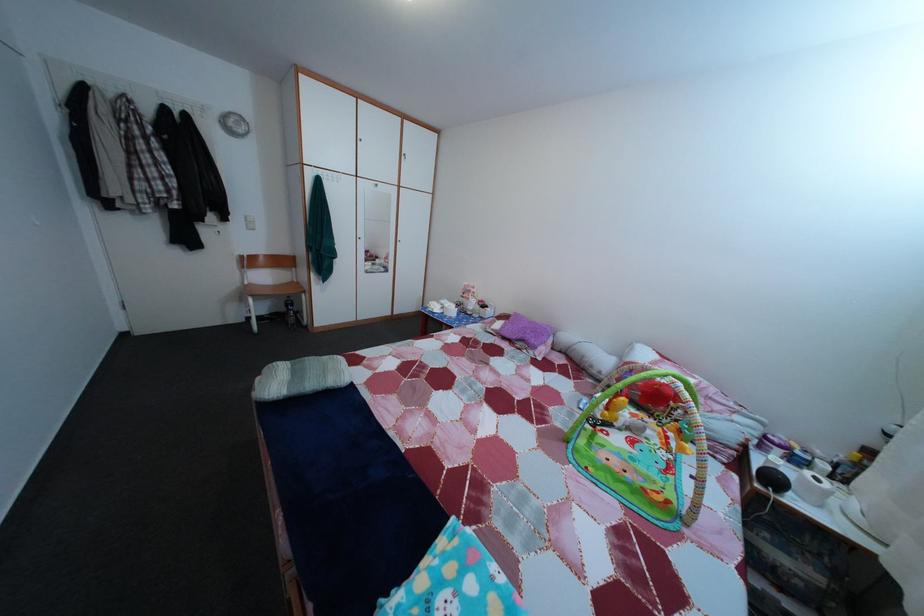
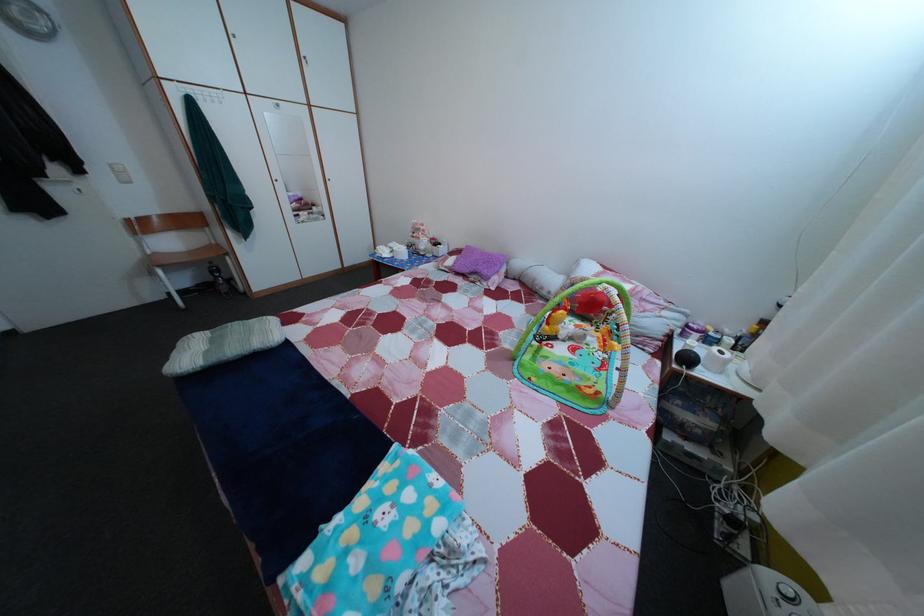
In the second image, find the point that corresponds to pixel 603 379 in the first image.

(553, 301)